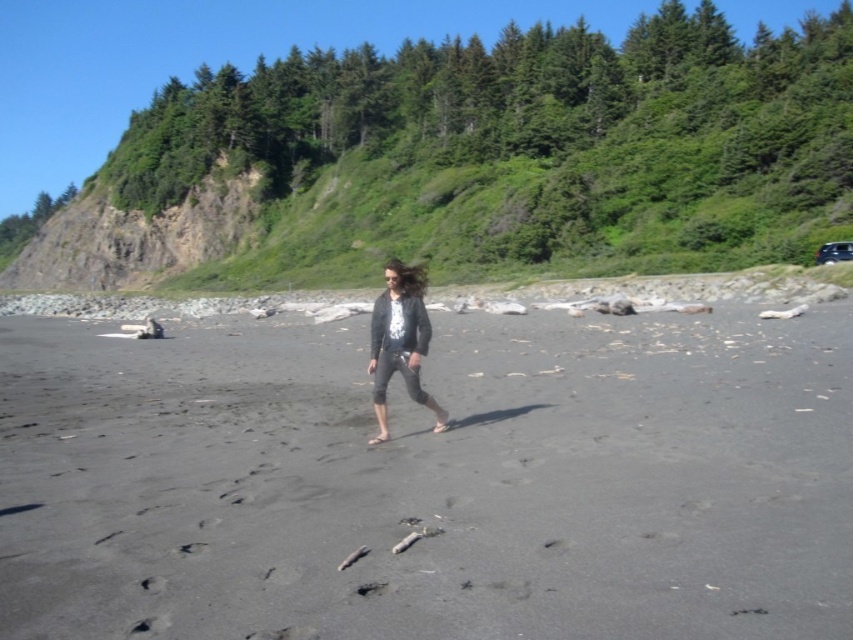
Is dark gray sand at center taller than green leafy hillside at upper center?

In fact, dark gray sand at center may be shorter than green leafy hillside at upper center.

Does point (786, 474) come farther from viewer compared to point (705, 13)?

No, (786, 474) is closer to viewer.

Locate an element on the screen. This screenshot has height=640, width=853. dark gray sand at center is located at coordinates (430, 481).

Looking at this image, can you confirm if dark gray sand at center is positioned below dark gray knit sweater at center?

Correct, dark gray sand at center is located below dark gray knit sweater at center.

Which is behind, point (158, 552) or point (379, 356)?

Point (379, 356)

You are a GUI agent. You are given a task and a screenshot of the screen. Output one action in this format:
    pyautogui.click(x=<x>, y=<y>)
    Task: Click on the dark gray sand at center
    
    Given the screenshot: What is the action you would take?
    pyautogui.click(x=430, y=481)

Identify the location of green leafy hillside at upper center. (477, 160).

Can you confirm if green leafy hillside at upper center is bigger than dark gray knit sweater at center?

Correct, green leafy hillside at upper center is larger in size than dark gray knit sweater at center.

Is point (664, 204) positioned after point (386, 372)?

That is True.

Identify the location of green leafy hillside at upper center. Image resolution: width=853 pixels, height=640 pixels. (477, 160).